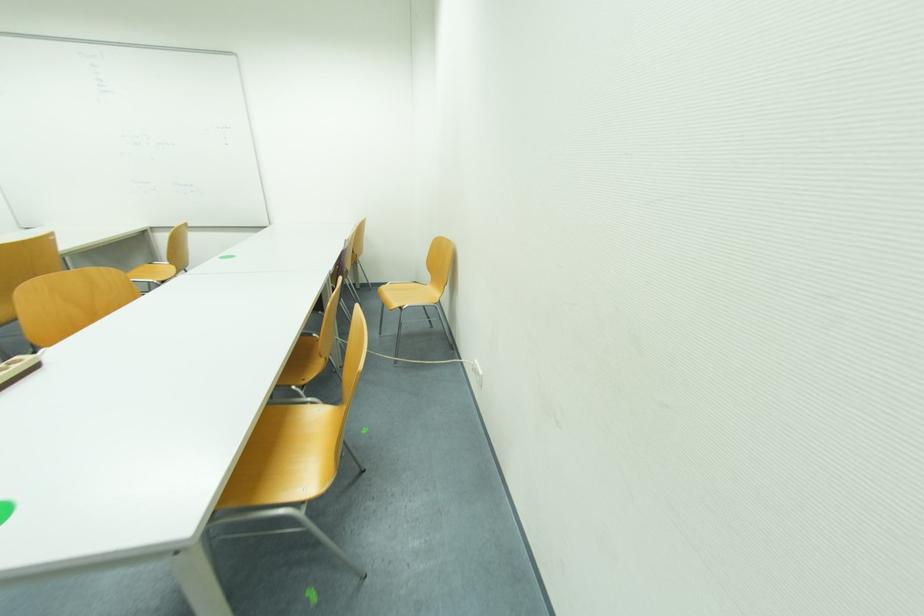
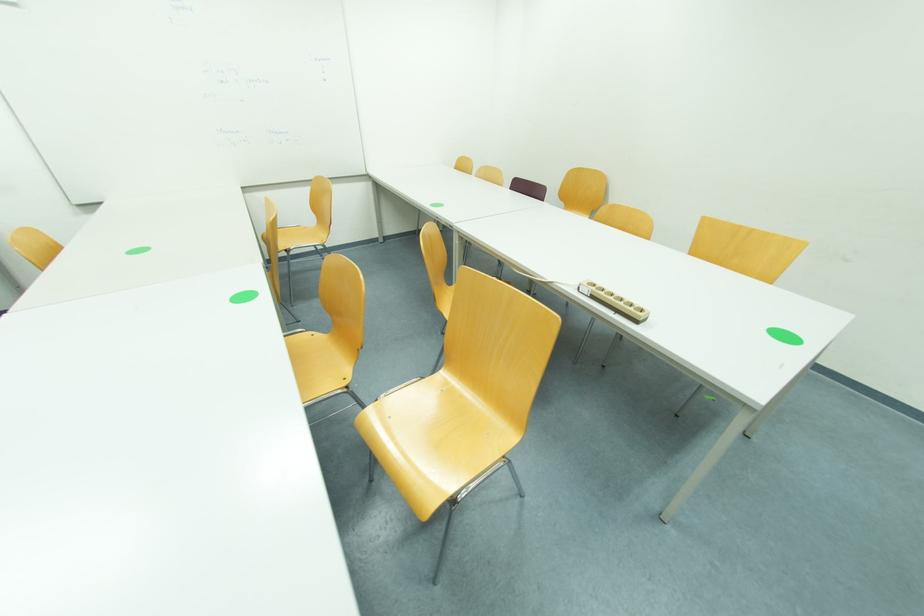
Question: Which direction would the cameraman need to move to produce the second image? Reply with the corresponding letter.

Choices:
 (A) Left
 (B) Right
 (C) Forward
 (D) Backward

Answer: (A)